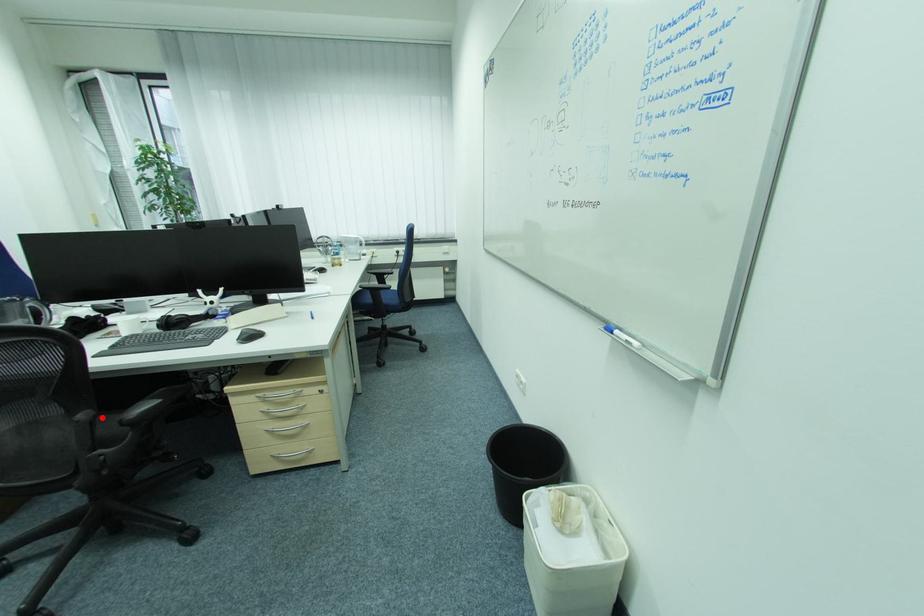
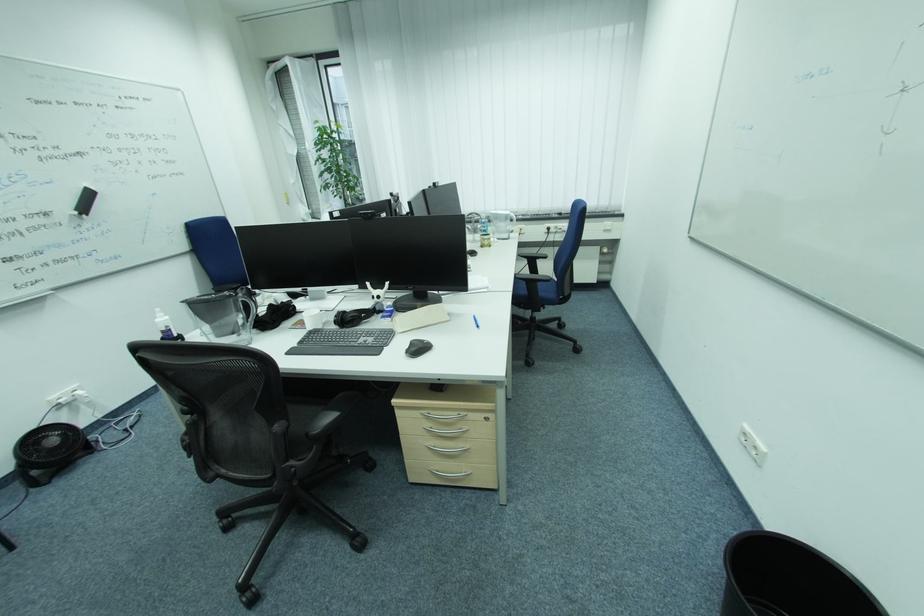
In the second image, find the point that corresponds to the highlighted location in the first image.

(294, 429)